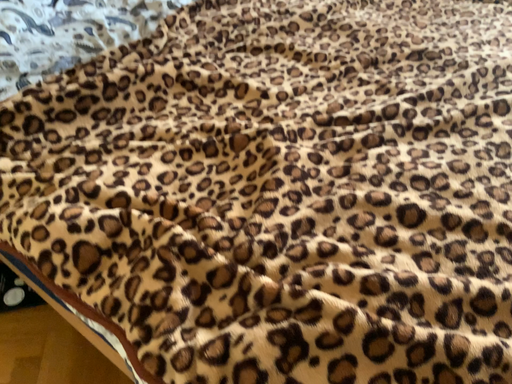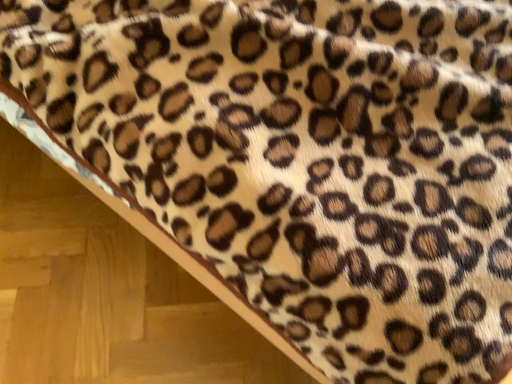
Question: Which way did the camera rotate in the video?

Choices:
 (A) rotated upward
 (B) rotated downward

Answer: (B)